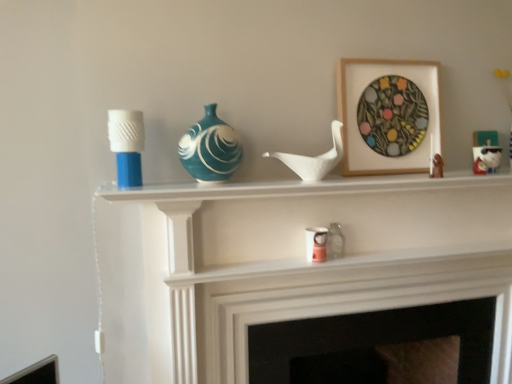
I want to click on vacant region to the right of white matte candle holder at left, arranged as the first candle holder when viewed from the left, so click(x=180, y=190).